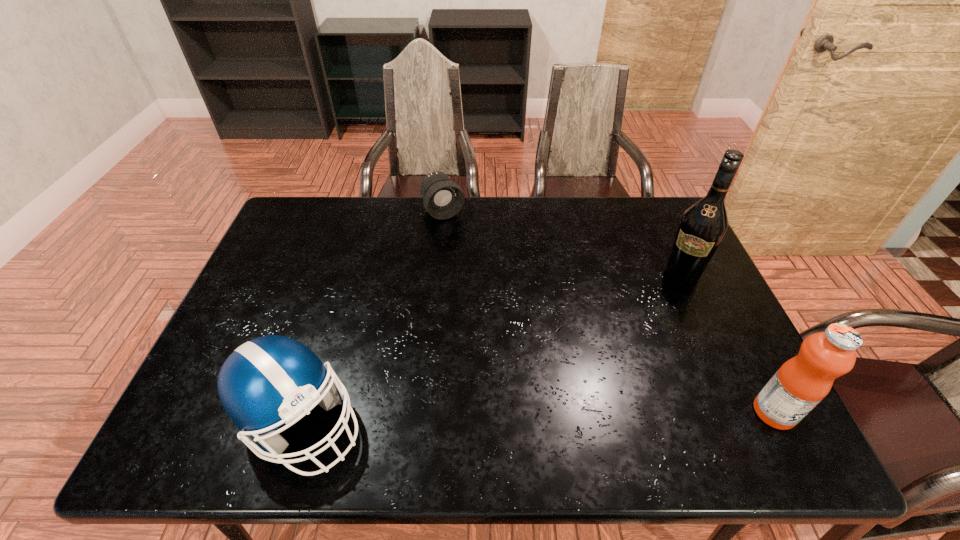
Locate an element on the screen. This screenshot has height=540, width=960. vacant space that's between the wine bottle and the football helmet is located at coordinates (492, 348).

Find the location of a particular element. Image resolution: width=960 pixels, height=540 pixels. free space between the fruit juice and the wine bottle is located at coordinates (729, 343).

Where is `vacant area between the tallest object and the football helmet`? This screenshot has height=540, width=960. vacant area between the tallest object and the football helmet is located at coordinates (492, 348).

Locate an element on the screen. The height and width of the screenshot is (540, 960). free space between the third tallest object and the shortest object is located at coordinates (372, 316).

Where is `free area in between the third object from right to left and the second tallest object`? This screenshot has height=540, width=960. free area in between the third object from right to left and the second tallest object is located at coordinates (609, 312).

You are a GUI agent. You are given a task and a screenshot of the screen. Output one action in this format:
    pyautogui.click(x=<x>, y=<y>)
    Task: Click on the vacant space that's between the telephoto lens and the second shortest object
    The image size is (960, 540).
    Given the screenshot: What is the action you would take?
    pyautogui.click(x=372, y=316)

Identify the location of blank region between the leftmost object and the third shortest object. pyautogui.click(x=538, y=417).

Where is `object that is the third closest to the second farthest object`? object that is the third closest to the second farthest object is located at coordinates (272, 380).

Select which object is the third closest to the second tallest object. Please provide its 2D coordinates. Your answer should be formatted as a tuple, i.e. [(x, y)], where the tuple contains the x and y coordinates of a point satisfying the conditions above.

[(443, 198)]

Image resolution: width=960 pixels, height=540 pixels. In order to click on vacant area in the image that satisfies the following two spatial constraints: 1. on the front side of the telephoto lens; 2. on the right side of the tallest object in this screenshot , I will do `click(437, 274)`.